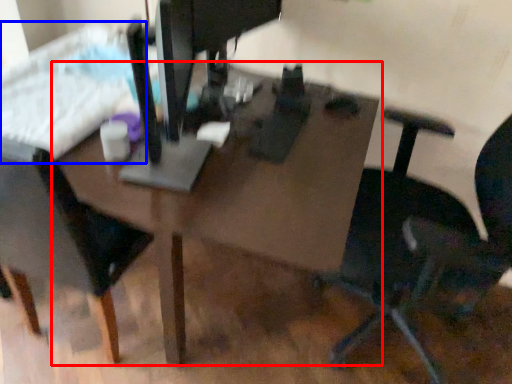
Question: Which point is further to the camera, table (highlighted by a red box) or bed (highlighted by a blue box)?

Choices:
 (A) table
 (B) bed

Answer: (B)